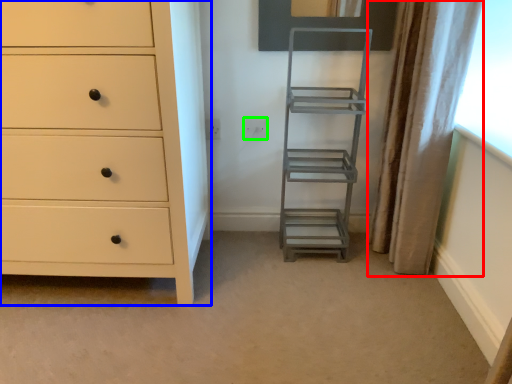
Question: Which object is positioned farthest from curtain (highlighted by a red box)? Select from chest of drawers (highlighted by a blue box) and electric outlet (highlighted by a green box).

Choices:
 (A) chest of drawers
 (B) electric outlet

Answer: (A)